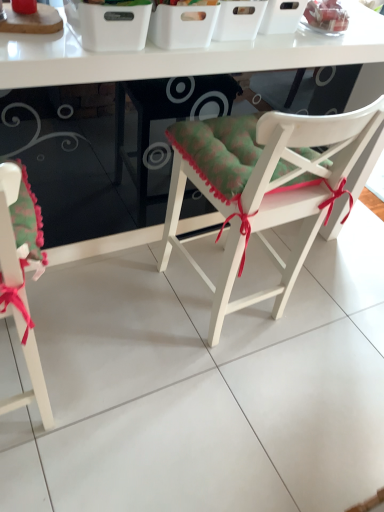
Question: Is white glossy table at center in front of or behind white plastic basket at upper center in the image?

Choices:
 (A) behind
 (B) front

Answer: (B)

Question: From the image's perspective, is white glossy table at center positioned above or below white plastic basket at upper center?

Choices:
 (A) above
 (B) below

Answer: (B)

Question: Which of these objects is positioned farthest from the white glossy table at center?

Choices:
 (A) white plastic basket at upper center
 (B) white wood chair at center, arranged as the second chair when viewed from the left
 (C) matte green cushion at lower left, acting as the 2th chair starting from the right

Answer: (C)

Question: Considering the real-world distances, which object is farthest from the white plastic basket at upper center?

Choices:
 (A) matte green cushion at lower left, acting as the 2th chair starting from the right
 (B) white wood chair at center, arranged as the second chair when viewed from the left
 (C) white glossy table at center

Answer: (A)